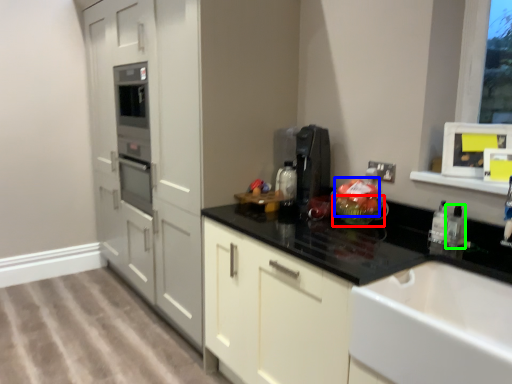
Question: Which is nearer to the glass bowl (highlighted by a red box)? food (highlighted by a blue box) or bottle (highlighted by a green box).

Choices:
 (A) food
 (B) bottle

Answer: (A)